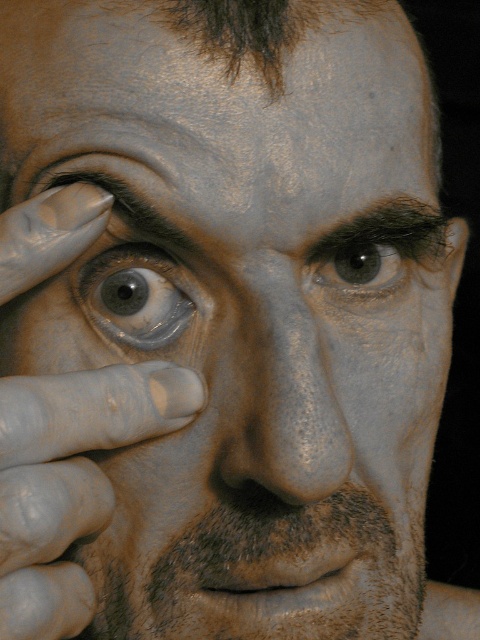
Based on the scene description, which object is wider, the smooth skin at upper center or the brown matte eye at center?

The smooth skin at upper center is wider than the brown matte eye at center according to the description.

Based on the coordinates provided in the scene description, where is the brown fuzzy eyebrow at upper center located in terms of its 2D position?

The brown fuzzy eyebrow at upper center is located at the 2D coordinates point (x=259, y=28).

In the image, you see a person with a brown fuzzy eyebrow at upper center and dark brown hair at upper center. Which of these two features is bigger in size?

The brown fuzzy eyebrow at upper center is larger in size compared to the dark brown hair at upper center.